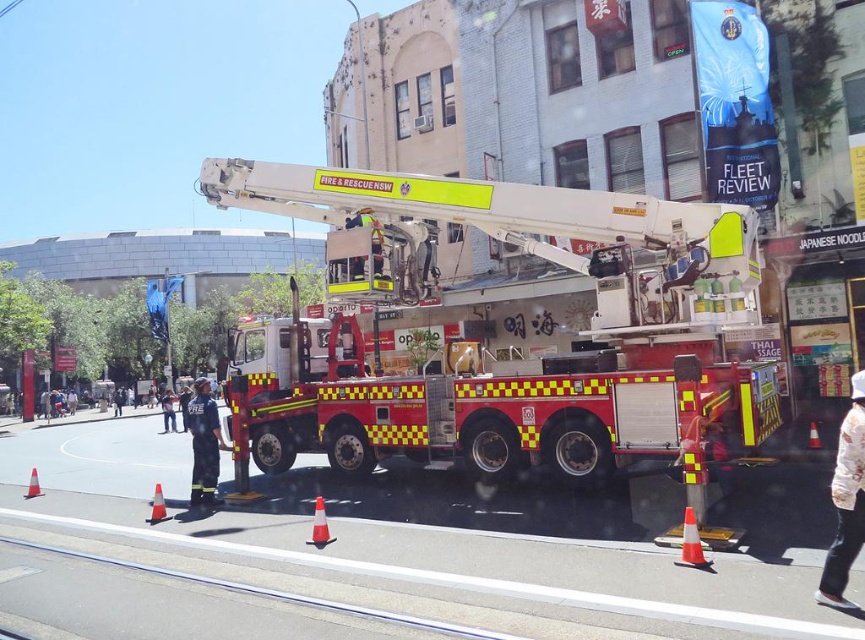
Question: Based on their relative distances, which object is nearer to the red/yellow checkered fire truck at center?

Choices:
 (A) orange reflective traffic cone at lower right
 (B) reflective silver helmet at center
 (C) orange reflective traffic cone at lower left
 (D) firefighter uniform at center

Answer: (D)

Question: In this image, where is firefighter uniform at center located relative to orange reflective traffic cone at lower left?

Choices:
 (A) right
 (B) left

Answer: (B)

Question: Can you confirm if floral-patterned shirt at lower right is smaller than orange reflective traffic cone at center?

Choices:
 (A) yes
 (B) no

Answer: (A)

Question: Does firefighter uniform at center appear over orange reflective traffic cone at lower left?

Choices:
 (A) yes
 (B) no

Answer: (B)

Question: Estimate the real-world distances between objects in this image. Which object is farther from the reflective silver helmet at center?

Choices:
 (A) orange reflective traffic cone at center
 (B) orange reflective traffic cone at lower left
 (C) orange plastic traffic cone at lower left
 (D) floral-patterned shirt at lower right

Answer: (D)

Question: Which point is closer to the camera?

Choices:
 (A) firefighter uniform at center
 (B) reflective silver helmet at center
 (C) orange reflective traffic cone at center

Answer: (A)